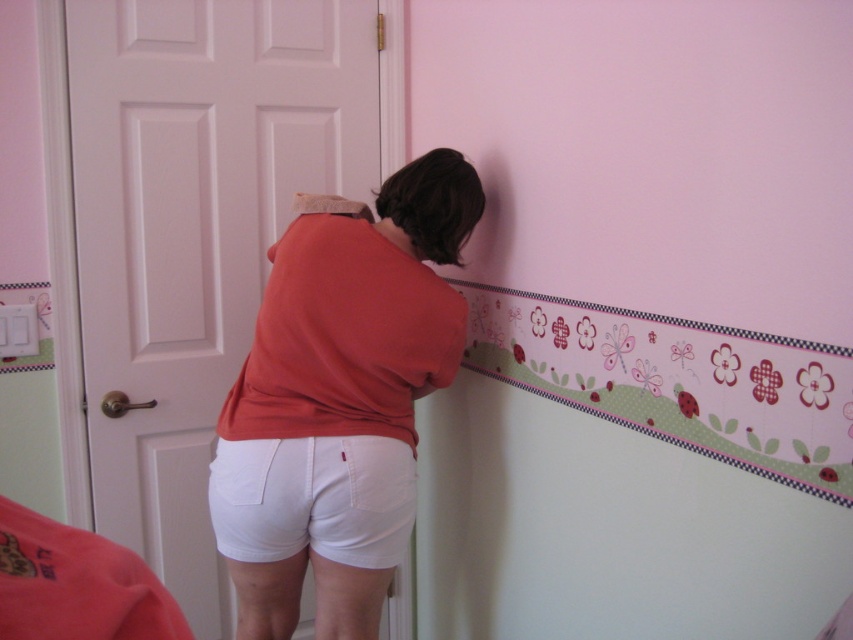
Question: Which object appears closest to the camera in this image?

Choices:
 (A) matte orange shirt at center
 (B) white cotton shorts at lower center

Answer: (B)

Question: Where is matte orange shirt at center located in relation to white cotton shorts at lower center in the image?

Choices:
 (A) below
 (B) above

Answer: (B)

Question: Does matte orange shirt at center appear on the right side of white cotton shorts at lower center?

Choices:
 (A) yes
 (B) no

Answer: (A)

Question: Which of the following is the closest to the observer?

Choices:
 (A) matte orange shirt at center
 (B) white cotton shorts at lower center

Answer: (B)

Question: Does matte orange shirt at center have a lesser width compared to white cotton shorts at lower center?

Choices:
 (A) no
 (B) yes

Answer: (A)